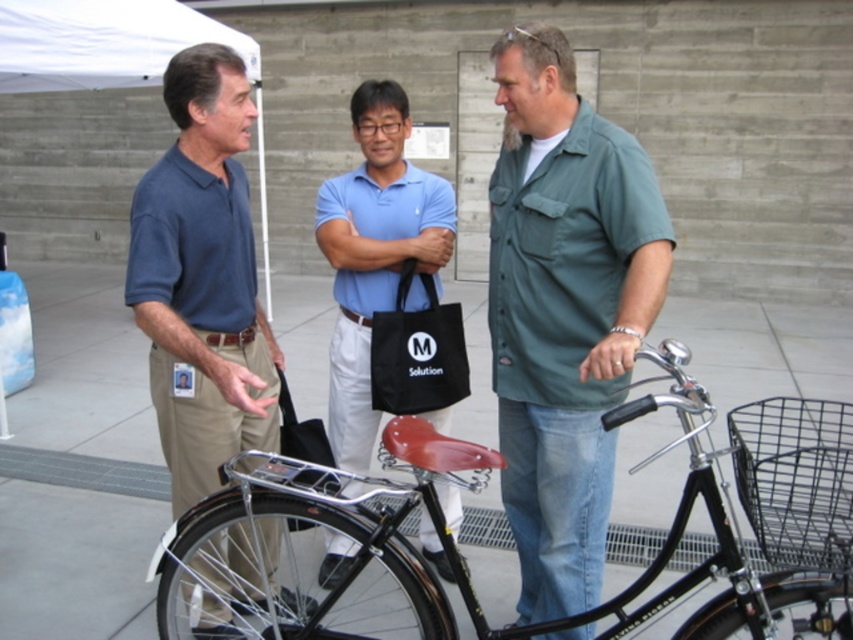
Based on the scene description, which object is taller, the matte blue shirt at left or the white fabric canopy at upper left?

The matte blue shirt at left is much taller than the white fabric canopy at upper left according to the description.